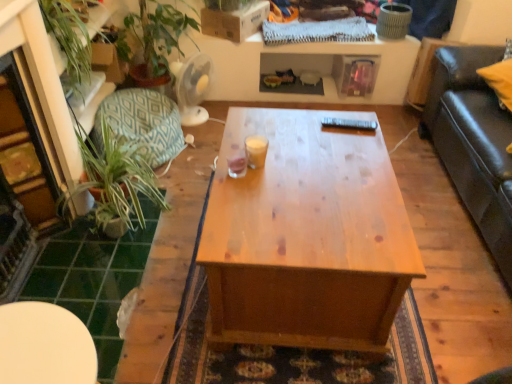
Question: Considering the relative sizes of white glossy table at lower left and translucent glass at center, which ranks as the second coffee cup in right-to-left order, in the image provided, is white glossy table at lower left wider than translucent glass at center, which ranks as the second coffee cup in right-to-left order,?

Choices:
 (A) yes
 (B) no

Answer: (A)

Question: Is white glossy table at lower left turned away from translucent glass at center, which appears as the 1th coffee cup when viewed from the left?

Choices:
 (A) no
 (B) yes

Answer: (A)

Question: Does white glossy table at lower left appear on the left side of translucent glass at center, which ranks as the second coffee cup in right-to-left order?

Choices:
 (A) yes
 (B) no

Answer: (A)

Question: Would you consider white glossy table at lower left to be distant from translucent glass at center, which appears as the 1th coffee cup when viewed from the left?

Choices:
 (A) no
 (B) yes

Answer: (A)

Question: Is white glossy table at lower left to the right of translucent glass at center, which appears as the 1th coffee cup when viewed from the left, from the viewer's perspective?

Choices:
 (A) yes
 (B) no

Answer: (B)

Question: From a real-world perspective, relative to white glossy table at lower left, is teal fabric cushion at left vertically above or below?

Choices:
 (A) below
 (B) above

Answer: (A)

Question: From the image's perspective, is teal fabric cushion at left positioned above or below white glossy table at lower left?

Choices:
 (A) below
 (B) above

Answer: (B)

Question: Is teal fabric cushion at left wider or thinner than white glossy table at lower left?

Choices:
 (A) thin
 (B) wide

Answer: (B)

Question: Is teal fabric cushion at left spatially inside white glossy table at lower left, or outside of it?

Choices:
 (A) inside
 (B) outside

Answer: (B)

Question: Is wooden coffee table at center spatially inside green tile at lower left, or outside of it?

Choices:
 (A) outside
 (B) inside

Answer: (A)

Question: From their relative heights in the image, would you say wooden coffee table at center is taller or shorter than green tile at lower left?

Choices:
 (A) short
 (B) tall

Answer: (B)

Question: Looking at their shapes, would you say wooden coffee table at center is wider or thinner than green tile at lower left?

Choices:
 (A) thin
 (B) wide

Answer: (B)

Question: Considering their positions, is wooden coffee table at center located in front of or behind green tile at lower left?

Choices:
 (A) behind
 (B) front

Answer: (B)

Question: From a real-world perspective, is teal fabric cushion at left positioned above or below translucent glass at center, which appears as the 1th coffee cup when viewed from the left?

Choices:
 (A) above
 (B) below

Answer: (B)

Question: In the image, is teal fabric cushion at left positioned in front of or behind translucent glass at center, which appears as the 1th coffee cup when viewed from the left?

Choices:
 (A) behind
 (B) front

Answer: (A)